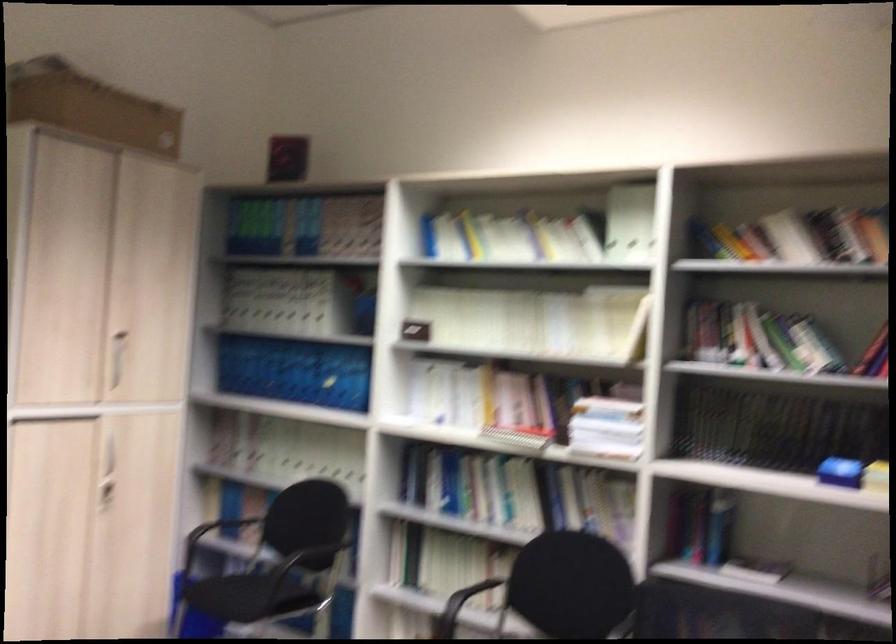
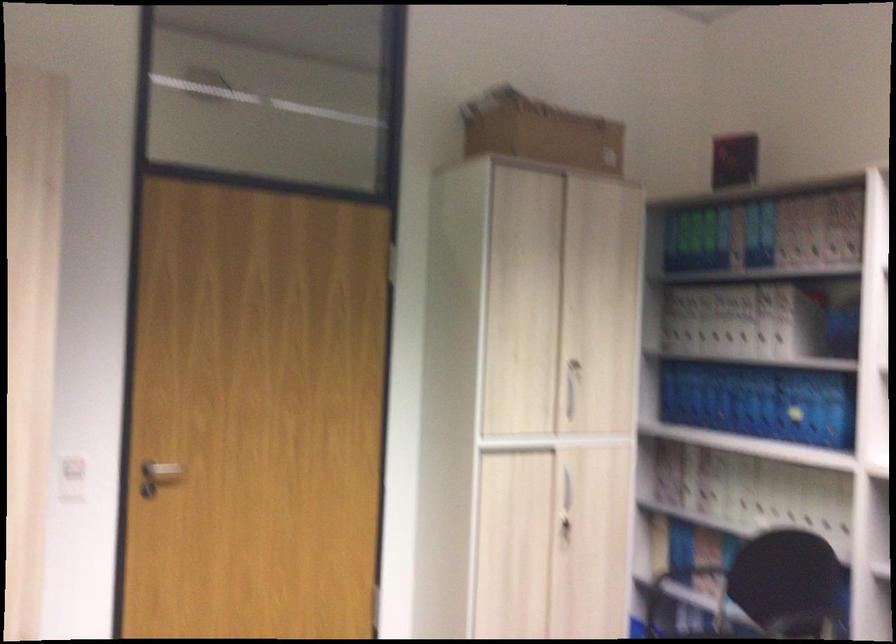
Question: The camera is either moving clockwise (left) or counter-clockwise (right) around the object. The first image is from the beginning of the video and the second image is from the end. Is the camera moving left or right when shooting the video?

Choices:
 (A) Left
 (B) Right

Answer: (B)